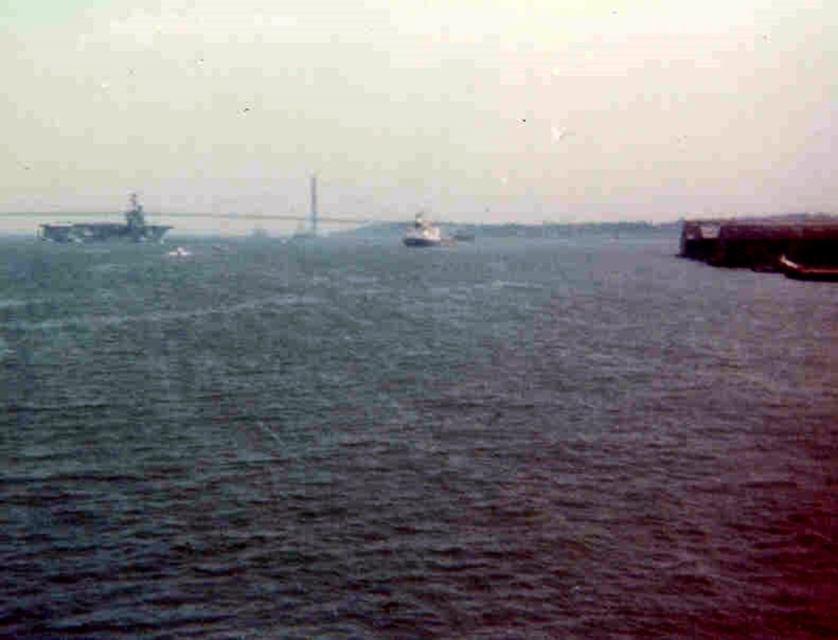
Does dark blue water at center have a larger size compared to metallic gray ship at left?

Yes.

Is point (379, 589) closer to viewer compared to point (143, 234)?

That is True.

Does point (242, 262) come in front of point (79, 241)?

Yes, it is.

Identify the location of dark blue water at center. This screenshot has height=640, width=838. (412, 444).

Does point (143, 236) come farther from viewer compared to point (417, 241)?

Yes, it is.

The image size is (838, 640). What do you see at coordinates (106, 228) in the screenshot? I see `metallic gray ship at left` at bounding box center [106, 228].

Is point (149, 236) behind point (438, 244)?

Yes, point (149, 236) is farther from viewer.

Locate an element on the screen. The height and width of the screenshot is (640, 838). metallic gray ship at left is located at coordinates (106, 228).

Where is `dark blue water at center`? The height and width of the screenshot is (640, 838). dark blue water at center is located at coordinates (412, 444).

Locate an element on the screen. Image resolution: width=838 pixels, height=640 pixels. dark blue water at center is located at coordinates (412, 444).

Identify the location of dark blue water at center. (412, 444).